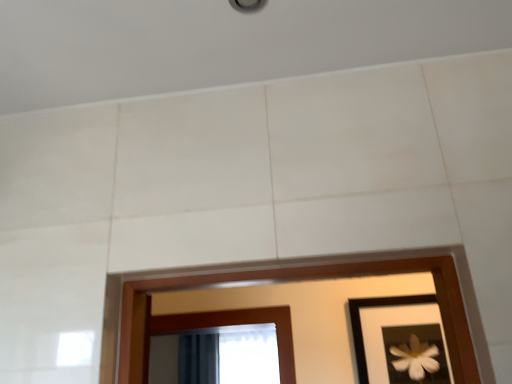
Describe the element at coordinates (398, 338) in the screenshot. I see `black matte picture frame at lower right` at that location.

Locate an element on the screen. The width and height of the screenshot is (512, 384). black matte picture frame at lower right is located at coordinates (398, 338).

Locate an element on the screen. The width and height of the screenshot is (512, 384). dark blue fabric at lower center is located at coordinates (198, 358).

What do you see at coordinates (198, 358) in the screenshot?
I see `dark blue fabric at lower center` at bounding box center [198, 358].

Identify the location of black matte picture frame at lower right. The image size is (512, 384). (398, 338).

Which is more to the left, black matte picture frame at lower right or dark blue fabric at lower center?

dark blue fabric at lower center is more to the left.

Is black matte picture frame at lower right positioned in front of dark blue fabric at lower center?

Yes, it is in front of dark blue fabric at lower center.

Which point is more distant from viewer, (417, 306) or (199, 382)?

The point (199, 382) is more distant.

From the image's perspective, is black matte picture frame at lower right above or below dark blue fabric at lower center?

Based on their image positions, black matte picture frame at lower right is located above dark blue fabric at lower center.

From a real-world perspective, which is physically below, black matte picture frame at lower right or dark blue fabric at lower center?

dark blue fabric at lower center is physically lower.

Does black matte picture frame at lower right have a greater width compared to dark blue fabric at lower center?

In fact, black matte picture frame at lower right might be narrower than dark blue fabric at lower center.

Considering the sizes of objects black matte picture frame at lower right and dark blue fabric at lower center in the image provided, who is taller, black matte picture frame at lower right or dark blue fabric at lower center?

dark blue fabric at lower center.

Can you confirm if black matte picture frame at lower right is bigger than dark blue fabric at lower center?

No, black matte picture frame at lower right is not bigger than dark blue fabric at lower center.

Is dark blue fabric at lower center completely or partially inside black matte picture frame at lower right?

No, dark blue fabric at lower center is not surrounded by black matte picture frame at lower right.

Is black matte picture frame at lower right beside dark blue fabric at lower center?

No, black matte picture frame at lower right is not in contact with dark blue fabric at lower center.

Consider the image. Is black matte picture frame at lower right oriented away from dark blue fabric at lower center?

Yes, black matte picture frame at lower right's orientation is away from dark blue fabric at lower center.

How many degrees apart are the facing directions of black matte picture frame at lower right and dark blue fabric at lower center?

The angular difference between black matte picture frame at lower right and dark blue fabric at lower center is 0.128 degrees.

Find the location of `picture frame above the dark blue fabric at lower center (from the image's perspective)`. picture frame above the dark blue fabric at lower center (from the image's perspective) is located at coordinates (398, 338).

In the image, is dark blue fabric at lower center on the left side or the right side of black matte picture frame at lower right?

In the image, dark blue fabric at lower center appears on the left side of black matte picture frame at lower right.

Is the depth of dark blue fabric at lower center greater than that of black matte picture frame at lower right?

Yes.

Between point (203, 343) and point (385, 367), which one is positioned behind?

Point (203, 343)

From the image's perspective, does dark blue fabric at lower center appear lower than black matte picture frame at lower right?

Yes, from the image's perspective, dark blue fabric at lower center is below black matte picture frame at lower right.

From a real-world perspective, who is located higher, dark blue fabric at lower center or black matte picture frame at lower right?

black matte picture frame at lower right, from a real-world perspective.

Does dark blue fabric at lower center have a greater width compared to black matte picture frame at lower right?

Indeed, dark blue fabric at lower center has a greater width compared to black matte picture frame at lower right.

Between dark blue fabric at lower center and black matte picture frame at lower right, which one has less height?

With less height is black matte picture frame at lower right.

Based on the photo, between dark blue fabric at lower center and black matte picture frame at lower right, which one has smaller size?

black matte picture frame at lower right is smaller.

Can black matte picture frame at lower right be found inside dark blue fabric at lower center?

Definitely not — black matte picture frame at lower right is not inside dark blue fabric at lower center.

Is dark blue fabric at lower center far away from black matte picture frame at lower right?

No, there isn't a large distance between dark blue fabric at lower center and black matte picture frame at lower right.

Is dark blue fabric at lower center positioned with its back to black matte picture frame at lower right?

No, black matte picture frame at lower right is not at the back of dark blue fabric at lower center.

How different are the orientations of dark blue fabric at lower center and black matte picture frame at lower right in degrees?

There is a 0.128-degree angle between the facing directions of dark blue fabric at lower center and black matte picture frame at lower right.

Locate an element on the screen. This screenshot has width=512, height=384. picture frame in front of the dark blue fabric at lower center is located at coordinates (398, 338).

The image size is (512, 384). Identify the location of picture frame that is on the right side of dark blue fabric at lower center. (398, 338).

Image resolution: width=512 pixels, height=384 pixels. Identify the location of curtain on the left of the black matte picture frame at lower right. tap(198, 358).